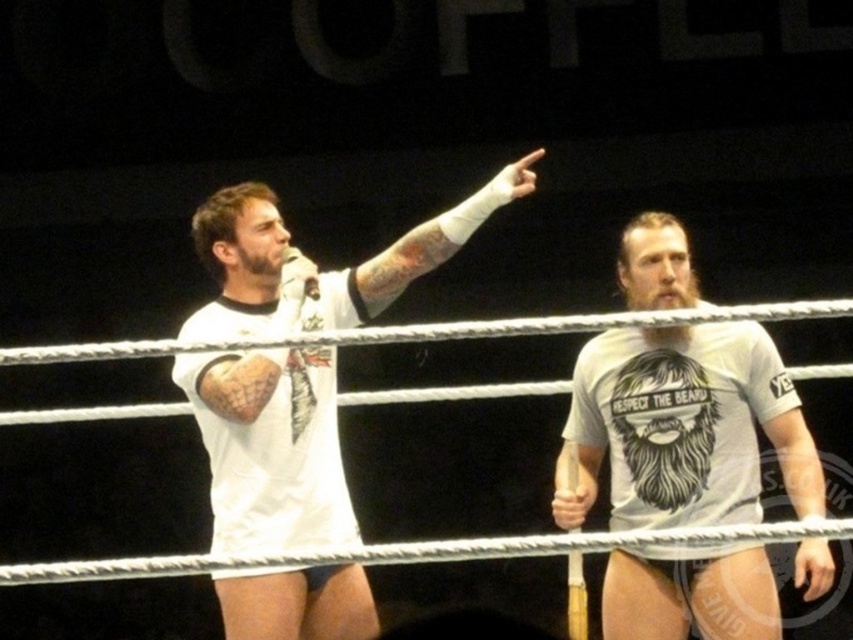
You are a photographer in the wrestling ring trying to capture a closeup of the white T shirt graphic. You notice a point at coordinates (x=683, y=428). Where is this point located?

The point at coordinates (x=683, y=428) is on the white matte t shirt at center.